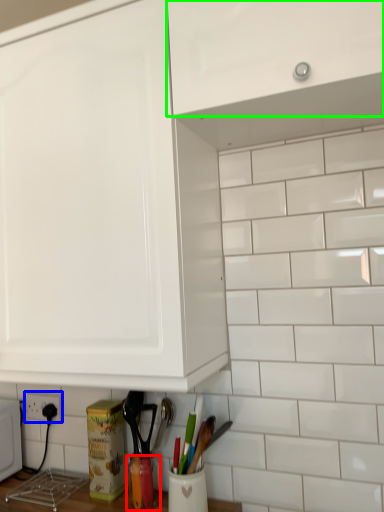
Question: Which object is positioned farthest from appliance (highlighted by a red box)? Select from electric outlet (highlighted by a blue box) and cabinetry (highlighted by a green box).

Choices:
 (A) electric outlet
 (B) cabinetry

Answer: (B)